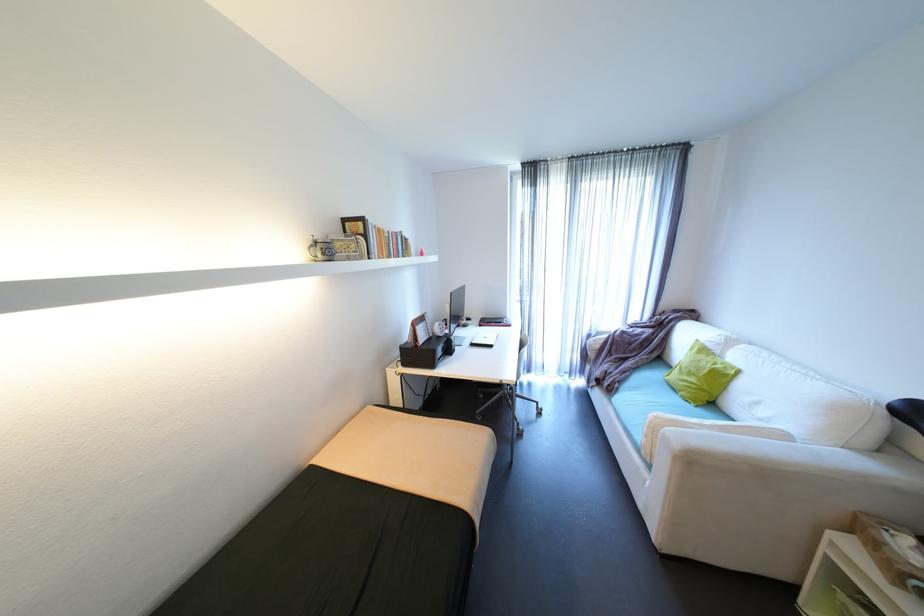
Find where to flip the desk calendar. Please return your answer as a coordinate pair (x, y).

(456, 307)